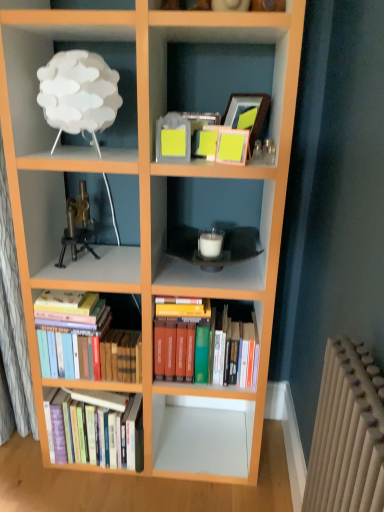
Question: Does brass/bronze tripod at center-left have a greater height compared to white matte lamp at upper left?

Choices:
 (A) no
 (B) yes

Answer: (A)

Question: Is brass/bronze tripod at center-left wider than white matte lamp at upper left?

Choices:
 (A) no
 (B) yes

Answer: (A)

Question: Does brass/bronze tripod at center-left contain white matte lamp at upper left?

Choices:
 (A) no
 (B) yes

Answer: (A)

Question: Is the depth of brass/bronze tripod at center-left greater than that of white matte lamp at upper left?

Choices:
 (A) no
 (B) yes

Answer: (B)

Question: Is brass/bronze tripod at center-left far from white matte lamp at upper left?

Choices:
 (A) yes
 (B) no

Answer: (B)

Question: From a real-world perspective, is brass/bronze tripod at center-left beneath white matte lamp at upper left?

Choices:
 (A) no
 (B) yes

Answer: (B)

Question: Is hardcover books at lower left, marked as the 2th book in a right-to-left arrangement, shorter than white matte lamp at upper left?

Choices:
 (A) no
 (B) yes

Answer: (A)

Question: Is the position of hardcover books at lower left, marked as the 2th book in a right-to-left arrangement, less distant than that of white matte lamp at upper left?

Choices:
 (A) yes
 (B) no

Answer: (B)

Question: Can you confirm if hardcover books at lower left, arranged as the 2th book when viewed from the left, is bigger than white matte lamp at upper left?

Choices:
 (A) no
 (B) yes

Answer: (B)

Question: Is hardcover books at lower left, arranged as the 2th book when viewed from the left, aimed at white matte lamp at upper left?

Choices:
 (A) yes
 (B) no

Answer: (B)

Question: From the image's perspective, is hardcover books at lower left, marked as the 2th book in a right-to-left arrangement, over white matte lamp at upper left?

Choices:
 (A) yes
 (B) no

Answer: (B)

Question: Is hardcover books at lower left, arranged as the 2th book when viewed from the left, positioned behind white matte lamp at upper left?

Choices:
 (A) yes
 (B) no

Answer: (A)

Question: Is hardcover books at lower left, arranged as the third book when viewed from the right, thinner than hardcover books at center, the third book positioned from the left?

Choices:
 (A) yes
 (B) no

Answer: (A)